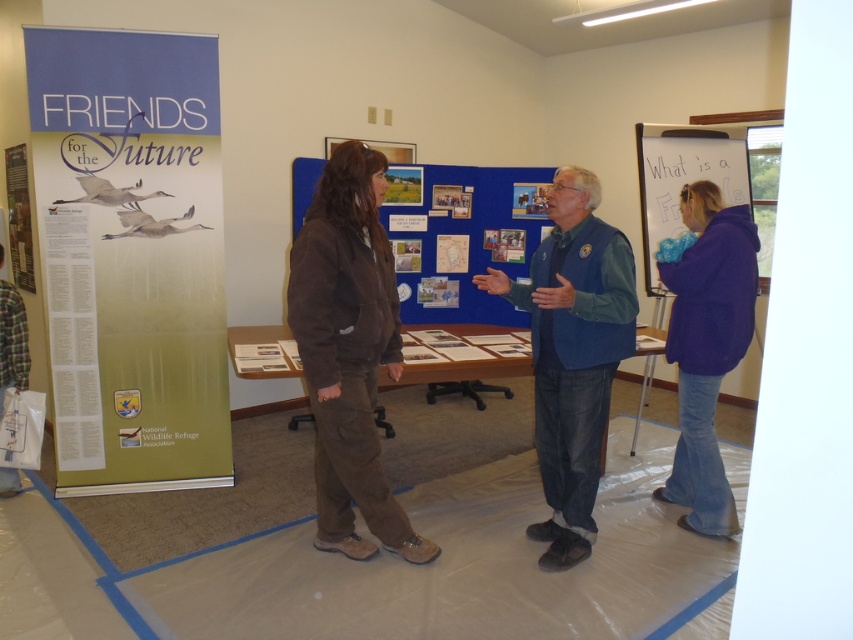
Question: Is purple fleece jacket at right behind denim jacket at lower left?

Choices:
 (A) yes
 (B) no

Answer: (B)

Question: Based on their relative distances, which object is nearer to the purple fleece jacket at right?

Choices:
 (A) denim jacket at lower left
 (B) brown corduroy jacket at center

Answer: (B)

Question: Estimate the real-world distances between objects in this image. Which object is farther from the whiteboard at upper right?

Choices:
 (A) purple fleece jacket at right
 (B) brown corduroy jacket at center
 (C) denim jacket at lower left

Answer: (C)

Question: Which object is positioned farthest from the purple fleece jacket at right?

Choices:
 (A) whiteboard at upper right
 (B) blue fabric poster at center

Answer: (B)

Question: Observing the image, what is the correct spatial positioning of blue fabric poster at center in reference to denim jacket at lower left?

Choices:
 (A) left
 (B) right

Answer: (B)

Question: Does blue fabric poster at center appear on the left side of whiteboard at upper right?

Choices:
 (A) yes
 (B) no

Answer: (A)